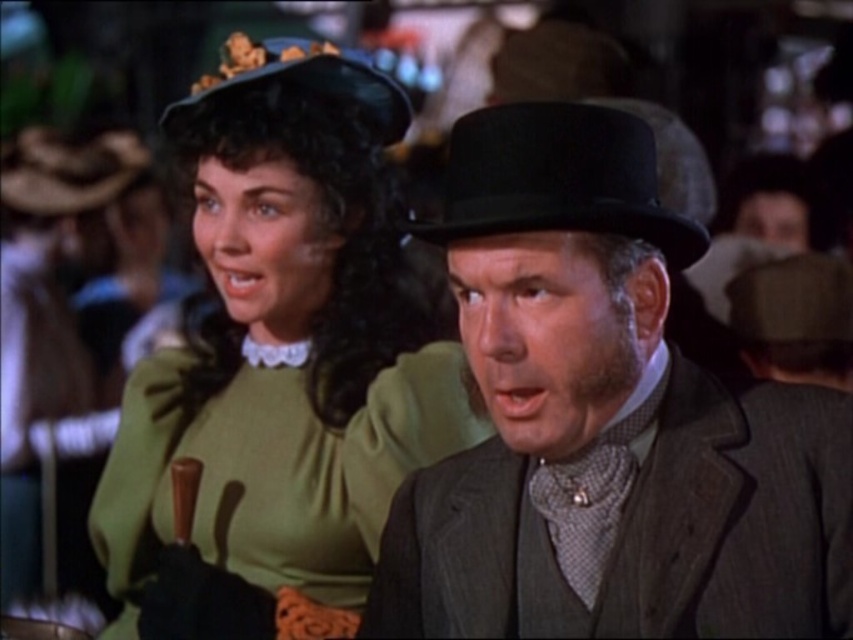
You are a costume designer measuring the distance between the matte black hat at center and the green velvet dress at upper left for a historical film scene. The minimum required distance for proper camera framing is 30 inches. Is the current distance sufficient?

The distance between the matte black hat at center and the green velvet dress at upper left is 28.85 inches, which is less than the required 30 inches. Therefore, the current distance is insufficient for proper camera framing.

You are a costume designer preparing for a historical play. You need to ensure that the matte black hat at center and the green velvet dress at upper left will fit within the stage backdrop which is 2 meters wide. Given their sizes, will both items fit side by side without overlapping?

The matte black hat at center is narrower than the green velvet dress at upper left. However, since the exact widths are not provided, it is impossible to determine if both items will fit within the 2 meters backdrop without overlapping.

You are a photographer standing in front of a historic painting. You want to take a closeup shot of the green velvet dress at upper left without moving the camera. Can you estimate if the dress is within the 2 meters focal range of your camera lens?

The green velvet dress at upper left is 2.10 meters away from the viewer. Since the focal range is 2 meters, the dress is slightly out of range and might not be in focus without adjusting the camera settings or moving closer.